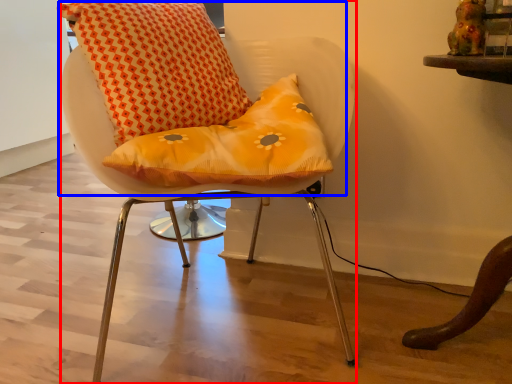
Question: Which of the following is the closest to the observer, chair (highlighted by a red box) or bean bag chair (highlighted by a blue box)?

Choices:
 (A) chair
 (B) bean bag chair

Answer: (A)